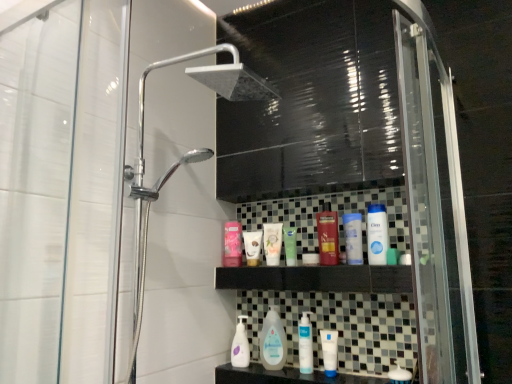
Image resolution: width=512 pixels, height=384 pixels. I want to click on green matte tube at center, the 4th toiletry in the left-to-right sequence, so click(290, 245).

Describe the element at coordinates (272, 242) in the screenshot. I see `white matte tube at center, marked as the third toiletry in a left-to-right arrangement` at that location.

This screenshot has height=384, width=512. What do you see at coordinates (328, 236) in the screenshot?
I see `matte red bottle at center, the sixth toiletry when ordered from left to right` at bounding box center [328, 236].

Locate an element on the screen. The width and height of the screenshot is (512, 384). white glossy soap at lower center, which ranks as the 8th toiletry in left-to-right order is located at coordinates (400, 375).

This screenshot has height=384, width=512. What do you see at coordinates (305, 344) in the screenshot? I see `white glossy mouthwash at lower center, which is the 2th mouthwash in top-to-bottom order` at bounding box center [305, 344].

Locate an element on the screen. The height and width of the screenshot is (384, 512). white matte tube at center, the 2th mouthwash from the right is located at coordinates (329, 351).

What are the coordinates of `blue plastic mouthwash at upper center, which is counted as the 1th mouthwash, starting from the right` in the screenshot? It's located at (353, 238).

In the image, is blue plastic mouthwash at upper center, the 3th mouthwash in the bottom-to-top sequence, on the left side or the right side of matte white tube at center, which is the 2th toiletry in left-to-right order?

From the image, it's evident that blue plastic mouthwash at upper center, the 3th mouthwash in the bottom-to-top sequence, is to the right of matte white tube at center, which is the 2th toiletry in left-to-right order.

In the scene shown: Is blue plastic mouthwash at upper center, the 3th mouthwash in the bottom-to-top sequence, oriented towards matte white tube at center, which is the 2th toiletry in left-to-right order?

No, blue plastic mouthwash at upper center, the 3th mouthwash in the bottom-to-top sequence, does not turn towards matte white tube at center, which is the 2th toiletry in left-to-right order.

Is blue plastic mouthwash at upper center, marked as the 1th mouthwash in a top-to-bottom arrangement, taller or shorter than matte white tube at center, which is the 2th toiletry in left-to-right order?

Considering their sizes, blue plastic mouthwash at upper center, marked as the 1th mouthwash in a top-to-bottom arrangement, has more height than matte white tube at center, which is the 2th toiletry in left-to-right order.

From a real-world perspective, which is physically below, blue plastic mouthwash at upper center, the 3th mouthwash in the bottom-to-top sequence, or matte white tube at center, which is the 2th toiletry in left-to-right order?

In real-world perspective, matte white tube at center, which is the 2th toiletry in left-to-right order, is lower.

From a real-world perspective, is matte white tube at center, arranged as the 7th toiletry when viewed from the right, above or below clear plastic baby bottle at center, which is the first cleaning product in right-to-left order?

matte white tube at center, arranged as the 7th toiletry when viewed from the right, is above clear plastic baby bottle at center, which is the first cleaning product in right-to-left order.

Is matte white tube at center, arranged as the 7th toiletry when viewed from the right, touching clear plastic baby bottle at center, which is the first cleaning product in right-to-left order?

No.

Considering the relative positions of matte white tube at center, which is the 2th toiletry in left-to-right order, and clear plastic baby bottle at center, which is the first cleaning product in right-to-left order, in the image provided, is matte white tube at center, which is the 2th toiletry in left-to-right order, to the left or to the right of clear plastic baby bottle at center, which is the first cleaning product in right-to-left order,?

matte white tube at center, which is the 2th toiletry in left-to-right order, is to the left of clear plastic baby bottle at center, which is the first cleaning product in right-to-left order.

From the image's perspective, is matte white tube at center, arranged as the 7th toiletry when viewed from the right, located beneath clear plastic baby bottle at center, which is the first cleaning product in right-to-left order?

No, from the image's perspective, matte white tube at center, arranged as the 7th toiletry when viewed from the right, is not beneath clear plastic baby bottle at center, which is the first cleaning product in right-to-left order.

How many degrees apart are the facing directions of blue plastic mouthwash at upper center, which appears as the third mouthwash when viewed from the left, and transparent glass shower door at left?

89.6 degrees separate the facing orientations of blue plastic mouthwash at upper center, which appears as the third mouthwash when viewed from the left, and transparent glass shower door at left.

Based on the photo, measure the distance from blue plastic mouthwash at upper center, which is counted as the 1th mouthwash, starting from the right, to transparent glass shower door at left.

They are 25.90 inches apart.

Relative to transparent glass shower door at left, is blue plastic mouthwash at upper center, which appears as the third mouthwash when viewed from the left, in front or behind?

blue plastic mouthwash at upper center, which appears as the third mouthwash when viewed from the left, is behind transparent glass shower door at left.

From a real-world perspective, who is located lower, blue plastic mouthwash at upper center, the 3th mouthwash in the bottom-to-top sequence, or transparent glass shower door at left?

In real-world perspective, blue plastic mouthwash at upper center, the 3th mouthwash in the bottom-to-top sequence, is lower.

Is matte white tube at center, which is the 2th toiletry in left-to-right order, turned away from white glossy mouthwash at lower center, arranged as the second mouthwash when ordered from the bottom?

No.

Which is more to the left, matte white tube at center, arranged as the 7th toiletry when viewed from the right, or white glossy mouthwash at lower center, acting as the 3th mouthwash starting from the right?

From the viewer's perspective, matte white tube at center, arranged as the 7th toiletry when viewed from the right, appears more on the left side.

Does matte white tube at center, which is the 2th toiletry in left-to-right order, have a smaller size compared to white glossy mouthwash at lower center, acting as the first mouthwash starting from the left?

No, matte white tube at center, which is the 2th toiletry in left-to-right order, is not smaller than white glossy mouthwash at lower center, acting as the first mouthwash starting from the left.

From the image's perspective, which is above, matte white tube at center, arranged as the 7th toiletry when viewed from the right, or white glossy mouthwash at lower center, acting as the first mouthwash starting from the left?

matte white tube at center, arranged as the 7th toiletry when viewed from the right, is shown above in the image.

Which object is thinner, matte red bottle at center, placed as the third toiletry when sorted from right to left, or white matte container at center, the fourth toiletry positioned from the right?

With smaller width is white matte container at center, the fourth toiletry positioned from the right.

Considering the relative sizes of matte red bottle at center, the sixth toiletry when ordered from left to right, and white matte container at center, placed as the fifth toiletry when sorted from left to right, in the image provided, is matte red bottle at center, the sixth toiletry when ordered from left to right, smaller than white matte container at center, placed as the fifth toiletry when sorted from left to right,?

No, matte red bottle at center, the sixth toiletry when ordered from left to right, is not smaller than white matte container at center, placed as the fifth toiletry when sorted from left to right.

From a real-world perspective, is matte red bottle at center, placed as the third toiletry when sorted from right to left, positioned under white matte container at center, placed as the fifth toiletry when sorted from left to right, based on gravity?

Incorrect, from a real-world perspective, matte red bottle at center, placed as the third toiletry when sorted from right to left, is higher than white matte container at center, placed as the fifth toiletry when sorted from left to right.

How many degrees apart are the facing directions of matte red bottle at center, the sixth toiletry when ordered from left to right, and white matte container at center, the fourth toiletry positioned from the right?

The facing directions of matte red bottle at center, the sixth toiletry when ordered from left to right, and white matte container at center, the fourth toiletry positioned from the right, are 0.000298 degrees apart.

From the image's perspective, which one is positioned lower, white glossy mouthwash at lower center, acting as the first mouthwash starting from the left, or matte white tube at center, arranged as the 7th toiletry when viewed from the right?

white glossy mouthwash at lower center, acting as the first mouthwash starting from the left.

Consider the image. From a real-world perspective, is white glossy mouthwash at lower center, which is the 2th mouthwash in top-to-bottom order, located beneath matte white tube at center, which is the 2th toiletry in left-to-right order?

Correct, in the physical world, white glossy mouthwash at lower center, which is the 2th mouthwash in top-to-bottom order, is lower than matte white tube at center, which is the 2th toiletry in left-to-right order.

Is white glossy mouthwash at lower center, acting as the 3th mouthwash starting from the right, aimed at matte white tube at center, arranged as the 7th toiletry when viewed from the right?

No.

Is point (303, 322) more distant than point (252, 259)?

No, (303, 322) is in front of (252, 259).

Is green matte tube at center, arranged as the 5th toiletry when viewed from the right, surrounded by white glossy mouthwash at lower center, acting as the 3th mouthwash starting from the right?

Definitely not — green matte tube at center, arranged as the 5th toiletry when viewed from the right, is not inside white glossy mouthwash at lower center, acting as the 3th mouthwash starting from the right.

In order to click on the 1st mouthwash positioned below the green matte tube at center, the 4th toiletry in the left-to-right sequence (from a real-world perspective) in this screenshot , I will do `click(305, 344)`.

Is white glossy mouthwash at lower center, arranged as the second mouthwash when ordered from the bottom, closer to camera compared to green matte tube at center, arranged as the 5th toiletry when viewed from the right?

Yes, it is in front of green matte tube at center, arranged as the 5th toiletry when viewed from the right.

Is white glossy mouthwash at lower center, arranged as the second mouthwash when ordered from the bottom, oriented towards green matte tube at center, arranged as the 5th toiletry when viewed from the right?

No, white glossy mouthwash at lower center, arranged as the second mouthwash when ordered from the bottom, is not oriented towards green matte tube at center, arranged as the 5th toiletry when viewed from the right.

At what (x,y) coordinates should I click in order to perform the action: click on mouthwash lying above the matte white tube at center, arranged as the 7th toiletry when viewed from the right (from the image's perspective). Please return your answer as a coordinate pair (x, y). The image size is (512, 384). Looking at the image, I should click on (353, 238).

Image resolution: width=512 pixels, height=384 pixels. There is a clear plastic baby bottle at center, the second cleaning product in the left-to-right sequence. In order to click on the 2nd toiletry above it (from a real-world perspective) in this screenshot , I will do `click(252, 247)`.

Estimate the real-world distances between objects in this image. Which object is closer to pink matte lotion at upper center, which appears as the 8th toiletry when viewed from the right, matte red bottle at center, placed as the third toiletry when sorted from right to left, or green matte tube at center, the 4th toiletry in the left-to-right sequence?

green matte tube at center, the 4th toiletry in the left-to-right sequence, lies closer to pink matte lotion at upper center, which appears as the 8th toiletry when viewed from the right, than the other object.

From the image, which object appears to be farther from clear plastic baby bottle at center, which is the first cleaning product in right-to-left order, white glossy lotion at center, which appears as the 2th toiletry when viewed from the right, or pink matte lotion at upper center, marked as the 1th toiletry in a left-to-right arrangement?

white glossy lotion at center, which appears as the 2th toiletry when viewed from the right, is positioned further to the anchor clear plastic baby bottle at center, which is the first cleaning product in right-to-left order.

Considering their positions, is green matte tube at center, arranged as the 5th toiletry when viewed from the right, positioned further to clear plastic baby bottle at center, which is the first cleaning product in right-to-left order, than white glossy pump bottle at lower center, which ranks as the first cleaning product in left-to-right order?

green matte tube at center, arranged as the 5th toiletry when viewed from the right, is further to clear plastic baby bottle at center, which is the first cleaning product in right-to-left order.

From the image, which object appears to be farther from white matte tube at center, the sixth toiletry viewed from the right, white glossy pump bottle at lower center, which ranks as the first cleaning product in left-to-right order, or white glossy soap at lower center, which ranks as the 8th toiletry in left-to-right order?

white glossy soap at lower center, which ranks as the 8th toiletry in left-to-right order, is positioned further to the anchor white matte tube at center, the sixth toiletry viewed from the right.

From the image, which object appears to be farther from matte white tube at center, which is the 2th toiletry in left-to-right order, matte red bottle at center, the sixth toiletry when ordered from left to right, or clear plastic baby bottle at center, which is the first cleaning product in right-to-left order?

Based on the image, clear plastic baby bottle at center, which is the first cleaning product in right-to-left order, appears to be further to matte white tube at center, which is the 2th toiletry in left-to-right order.

When comparing their distances from clear plastic baby bottle at center, which is the first cleaning product in right-to-left order, does white matte container at center, the fourth toiletry positioned from the right, or pink matte lotion at upper center, marked as the 1th toiletry in a left-to-right arrangement, seem further?

pink matte lotion at upper center, marked as the 1th toiletry in a left-to-right arrangement, is further to clear plastic baby bottle at center, which is the first cleaning product in right-to-left order.

From the image, which object appears to be farther from transparent glass shower door at left, white glossy soap at lower center, which ranks as the 8th toiletry in left-to-right order, or blue plastic mouthwash at upper center, marked as the 1th mouthwash in a top-to-bottom arrangement?

white glossy soap at lower center, which ranks as the 8th toiletry in left-to-right order, is positioned further to the anchor transparent glass shower door at left.

Based on their spatial positions, is pink matte lotion at upper center, which appears as the 8th toiletry when viewed from the right, or green matte tube at center, arranged as the 5th toiletry when viewed from the right, closer to white matte container at center, placed as the fifth toiletry when sorted from left to right?

Based on the image, green matte tube at center, arranged as the 5th toiletry when viewed from the right, appears to be nearer to white matte container at center, placed as the fifth toiletry when sorted from left to right.

Identify the location of mouthwash between blue plastic mouthwash at upper center, which appears as the third mouthwash when viewed from the left, and white matte tube at center, acting as the 2th mouthwash starting from the left, in the vertical direction. The image size is (512, 384). (305, 344).

Find the location of a particular element. This screenshot has width=512, height=384. mouthwash between green matte tube at center, arranged as the 5th toiletry when viewed from the right, and white matte tube at center, placed as the 3th mouthwash when sorted from top to bottom, in the vertical direction is located at coordinates pyautogui.click(x=305, y=344).

You are a GUI agent. You are given a task and a screenshot of the screen. Output one action in this format:
    pyautogui.click(x=<x>, y=<y>)
    Task: Click on the toiletry located between white matte container at center, the fourth toiletry positioned from the right, and white glossy lotion at center, the 7th toiletry in the left-to-right sequence, in the left-right direction
    
    Given the screenshot: What is the action you would take?
    pyautogui.click(x=328, y=236)

The height and width of the screenshot is (384, 512). I want to click on cleaning product between white matte container at center, placed as the fifth toiletry when sorted from left to right, and white glossy pump bottle at lower center, which is counted as the second cleaning product, starting from the right, in the vertical direction, so click(x=273, y=341).